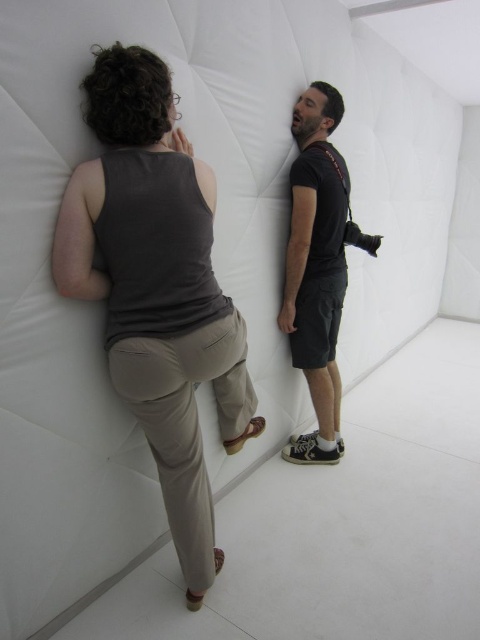
Question: Which point appears closest to the camera in this image?

Choices:
 (A) (319, 161)
 (B) (151, 342)

Answer: (B)

Question: Does matte gray tank top at upper left have a smaller size compared to black matte shirt at center?

Choices:
 (A) yes
 (B) no

Answer: (B)

Question: Does matte gray tank top at upper left appear over black matte shirt at center?

Choices:
 (A) yes
 (B) no

Answer: (B)

Question: Among these points, which one is nearest to the camera?

Choices:
 (A) (191, 520)
 (B) (313, 250)

Answer: (A)

Question: Is matte gray tank top at upper left in front of black matte shirt at center?

Choices:
 (A) yes
 (B) no

Answer: (A)

Question: Which of the following is the farthest from the observer?

Choices:
 (A) pyautogui.click(x=345, y=196)
 (B) pyautogui.click(x=113, y=52)

Answer: (A)